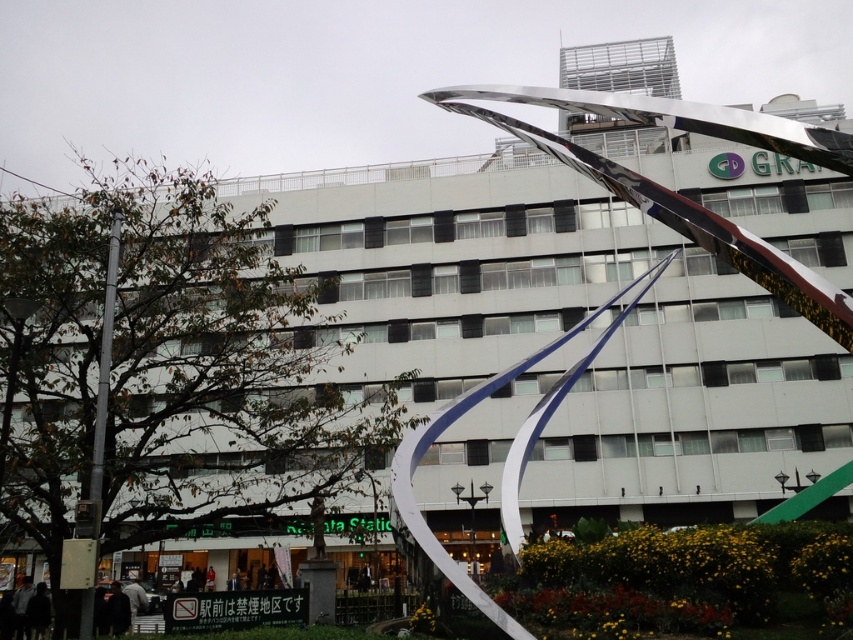
Question: Considering the relative positions of silver metallic pole at left and dark fabric jacket at lower left in the image provided, where is silver metallic pole at left located with respect to dark fabric jacket at lower left?

Choices:
 (A) below
 (B) above

Answer: (B)

Question: Does silver metallic pole at left lie behind dark fabric jacket at lower left?

Choices:
 (A) no
 (B) yes

Answer: (A)

Question: Which object is farther from the camera taking this photo?

Choices:
 (A) silver metallic pole at left
 (B) dark fabric jacket at lower left

Answer: (B)

Question: Considering the relative positions of silver metallic pole at left and dark fabric jacket at lower left in the image provided, where is silver metallic pole at left located with respect to dark fabric jacket at lower left?

Choices:
 (A) below
 (B) above

Answer: (B)

Question: Among these points, which one is farthest from the camera?

Choices:
 (A) (90, 621)
 (B) (117, 586)

Answer: (B)

Question: Which point is closer to the camera?

Choices:
 (A) (86, 620)
 (B) (115, 621)

Answer: (A)